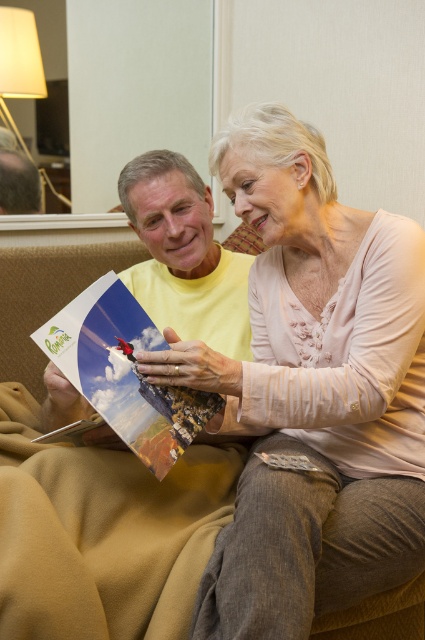
Question: Which of the following is the closest to the observer?

Choices:
 (A) (6, 177)
 (B) (149, 440)

Answer: (B)

Question: Can you confirm if matte paper postcard at center is positioned below matte yellow shirt at upper center?

Choices:
 (A) no
 (B) yes

Answer: (B)

Question: Where is matte paper postcard at center located in relation to matte yellow shirt at upper center in the image?

Choices:
 (A) right
 (B) left

Answer: (A)

Question: Does matte paper postcard at center appear on the right side of matte yellow shirt at upper center?

Choices:
 (A) yes
 (B) no

Answer: (A)